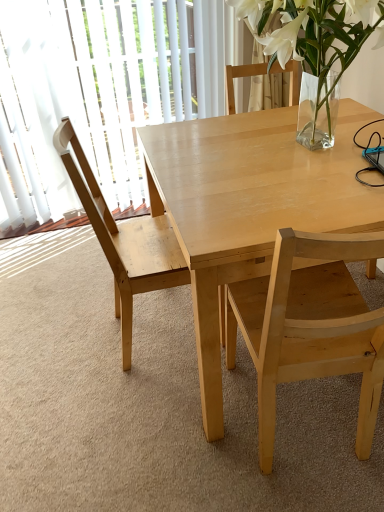
Locate an element on the screen. vacant region below light wood chair at left, which is the first chair from left to right (from a real-world perspective) is located at coordinates (151, 331).